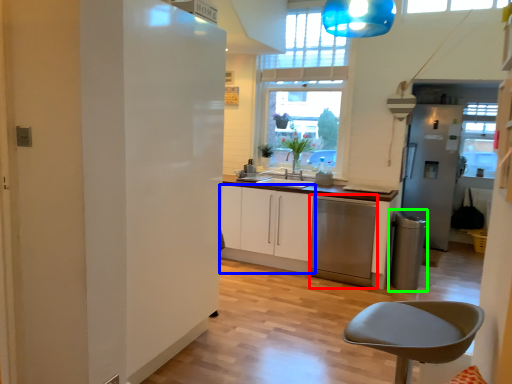
Question: Estimate the real-world distances between objects in this image. Which object is farther from dish washer (highlighted by a red box), cabinetry (highlighted by a blue box) or appliance (highlighted by a green box)?

Choices:
 (A) cabinetry
 (B) appliance

Answer: (B)